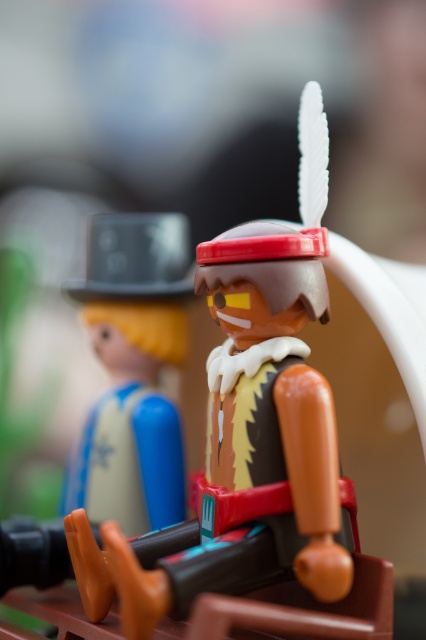
Can you confirm if matte plastic toy at center is shorter than matte black hat at left?

No, matte plastic toy at center is not shorter than matte black hat at left.

Which of these two, matte plastic toy at center or matte black hat at left, stands shorter?

matte black hat at left

Is point (268, 490) positioned in front of point (103, 438)?

Yes, point (268, 490) is closer to viewer.

I want to click on matte plastic toy at center, so click(250, 428).